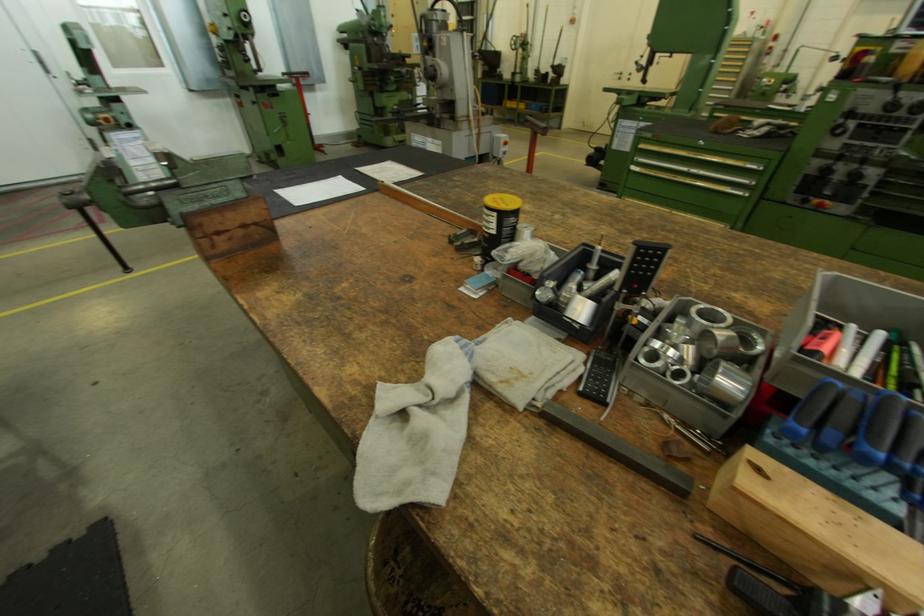
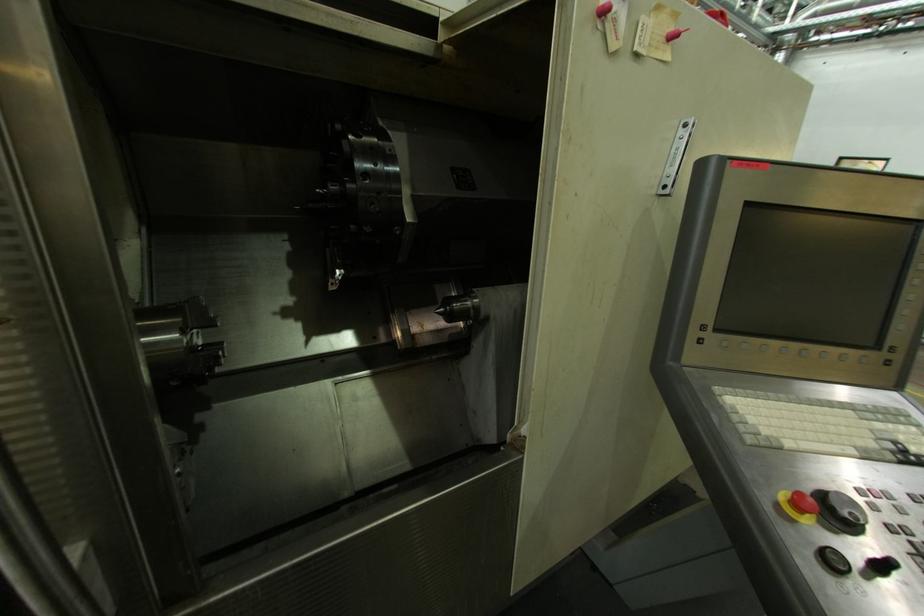
First-person continuous shooting, in which direction is the camera rotating?

The camera rotated toward left-down.